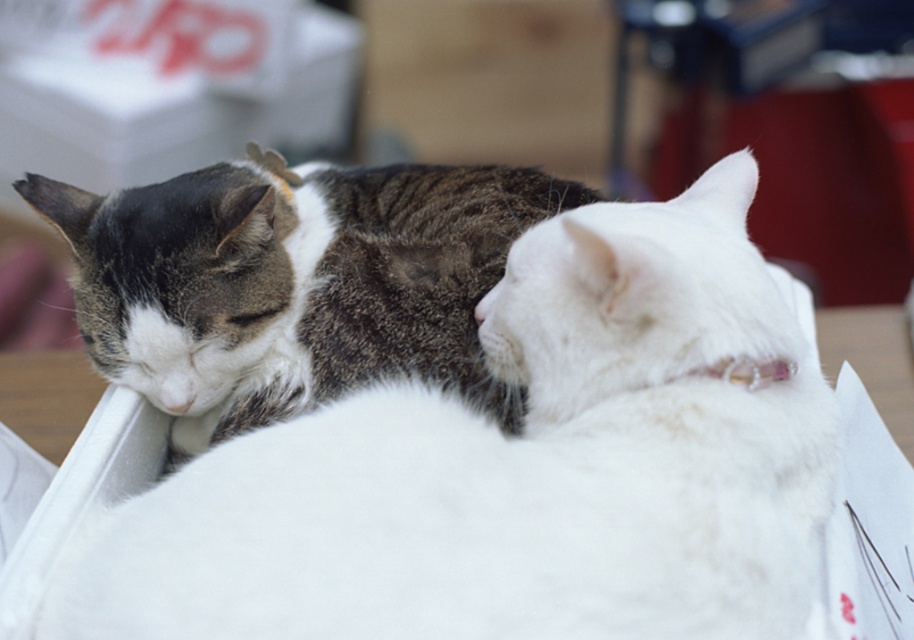
Question: Considering the relative positions of white fluffy cat at center and tabby fur cat at left in the image provided, where is white fluffy cat at center located with respect to tabby fur cat at left?

Choices:
 (A) above
 (B) below

Answer: (B)

Question: Which point is farther to the camera?

Choices:
 (A) (200, 364)
 (B) (594, 216)

Answer: (A)

Question: Which point appears closest to the camera in this image?

Choices:
 (A) (252, 204)
 (B) (714, 460)

Answer: (B)

Question: Does white fluffy cat at center have a smaller size compared to tabby fur cat at left?

Choices:
 (A) yes
 (B) no

Answer: (B)

Question: Can you confirm if white fluffy cat at center is positioned above tabby fur cat at left?

Choices:
 (A) yes
 (B) no

Answer: (B)